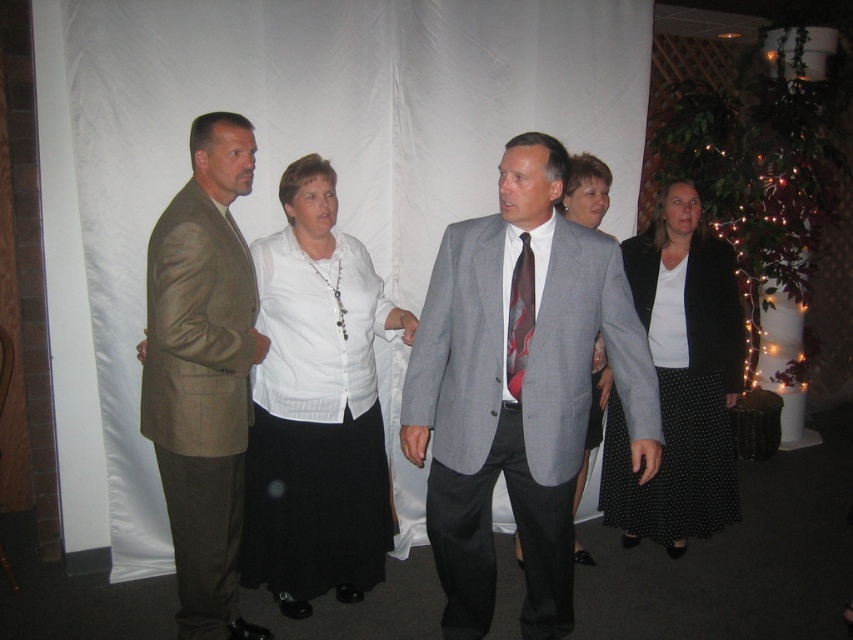
In the scene shown: You are organizing a charity event and need to arrange seating based on the size of the guests. The white fabric at center and the khaki fabric suit at left are two guests. Which guest requires a larger seat?

The white fabric at center requires a larger seat because it is bigger than the khaki fabric suit at left according to the description.